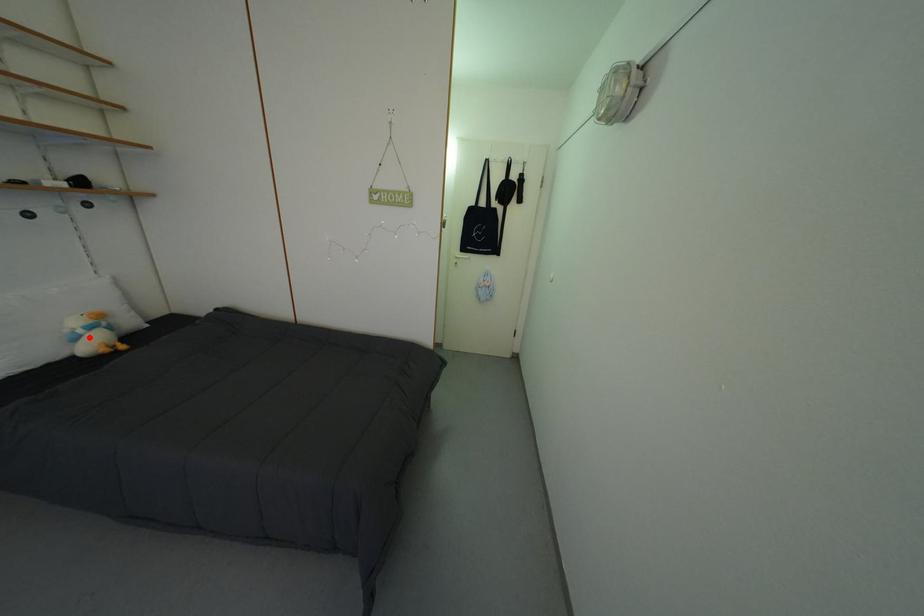
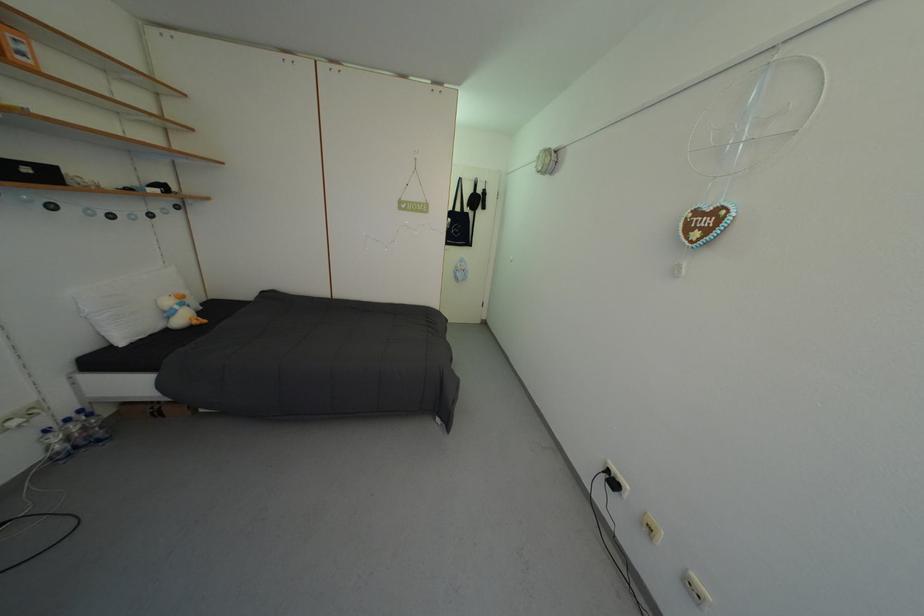
Locate, in the second image, the point that corresponds to the highlighted location in the first image.

(186, 313)